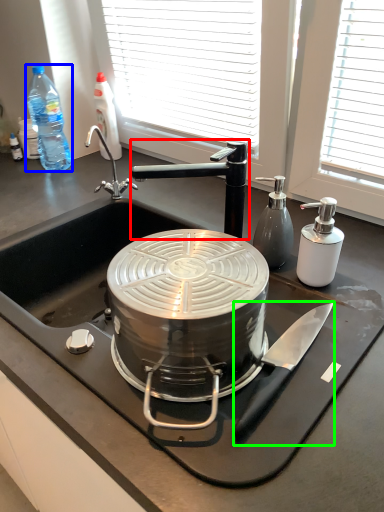
Question: Considering the real-world distances, which object is farthest from tap (highlighted by a red box)? bottle (highlighted by a blue box) or kitchen appliance (highlighted by a green box)?

Choices:
 (A) bottle
 (B) kitchen appliance

Answer: (A)